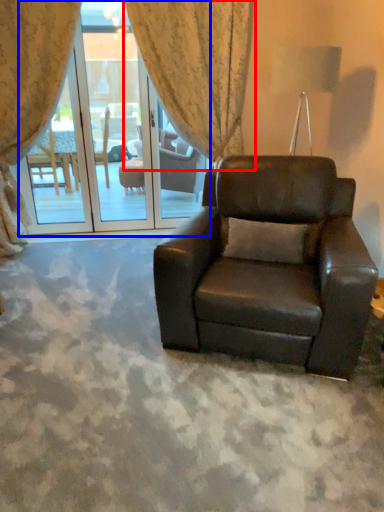
Question: Which of the following is the farthest to the observer, curtain (highlighted by a red box) or screen door (highlighted by a blue box)?

Choices:
 (A) curtain
 (B) screen door

Answer: (B)